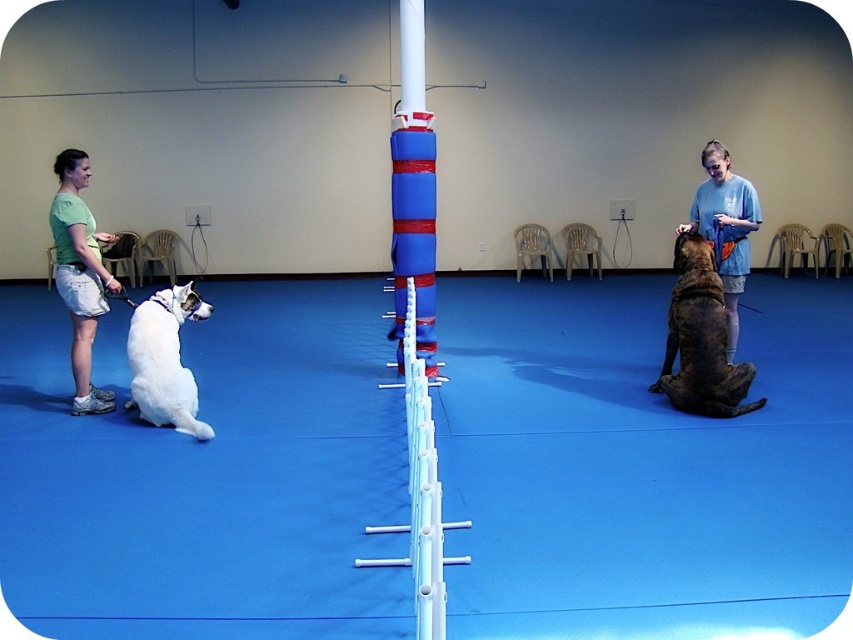
Which is in front, point (677, 403) or point (57, 234)?

Point (57, 234) is in front.

Between point (722, 364) and point (67, 269), which one is positioned behind?

The point (722, 364) is behind.

You are a GUI agent. You are given a task and a screenshot of the screen. Output one action in this format:
    pyautogui.click(x=<x>, y=<y>)
    Task: Click on the brown fur dog at right
    This screenshot has width=853, height=640.
    Given the screenshot: What is the action you would take?
    pyautogui.click(x=700, y=339)

This screenshot has width=853, height=640. Describe the element at coordinates (700, 339) in the screenshot. I see `brown fur dog at right` at that location.

Is brown fur dog at right in front of white fur dog at left?

No, it is not.

Identify the location of brown fur dog at right. (700, 339).

The image size is (853, 640). I want to click on brown fur dog at right, so click(700, 339).

Does green cotton shirt at left come behind white fur dog at left?

Yes, it is.

At what (x,y) coordinates should I click in order to perform the action: click on green cotton shirt at left. Please return your answer as a coordinate pair (x, y). This screenshot has width=853, height=640. Looking at the image, I should click on (79, 275).